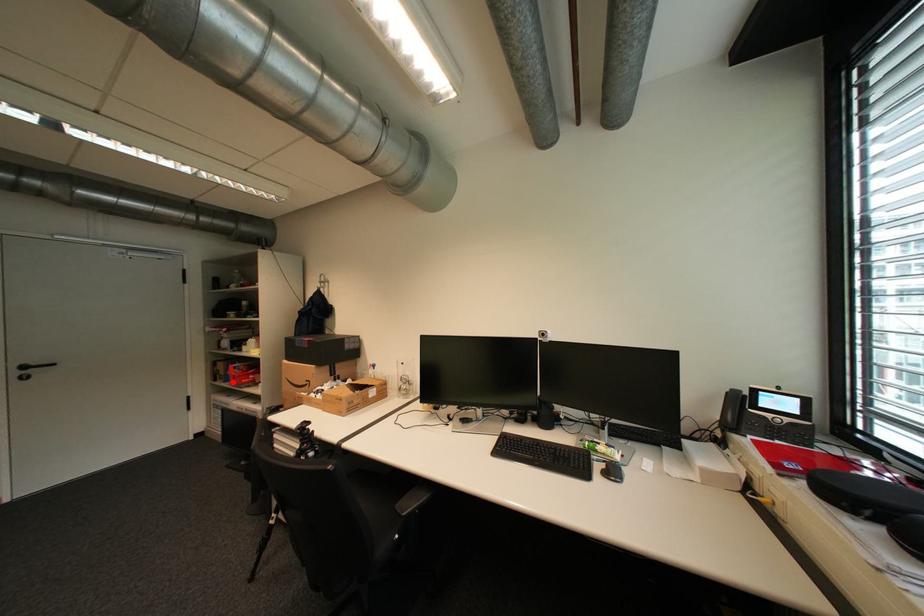
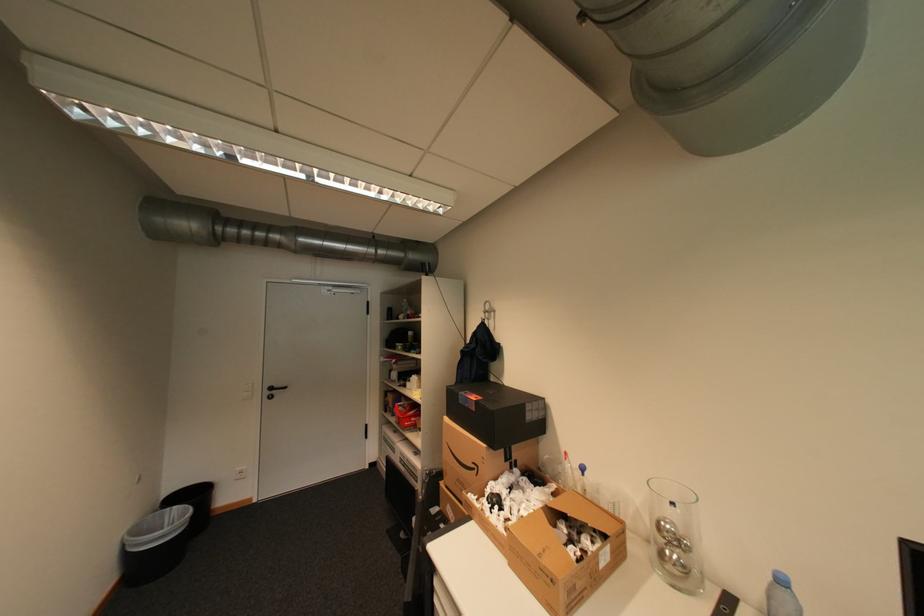
Question: I am providing you with two images of the same scene from different viewpoints. Given a red point in image1, look at the same physical point in image2. Is it:

Choices:
 (A) Closer to the viewpoint
 (B) Farther from the viewpoint

Answer: (B)